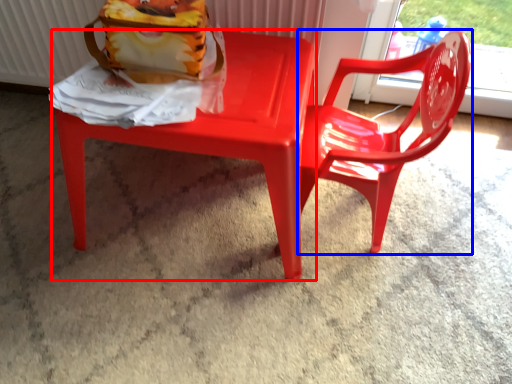
Question: Which point is closer to the camera, chair (highlighted by a red box) or chair (highlighted by a blue box)?

Choices:
 (A) chair
 (B) chair

Answer: (B)